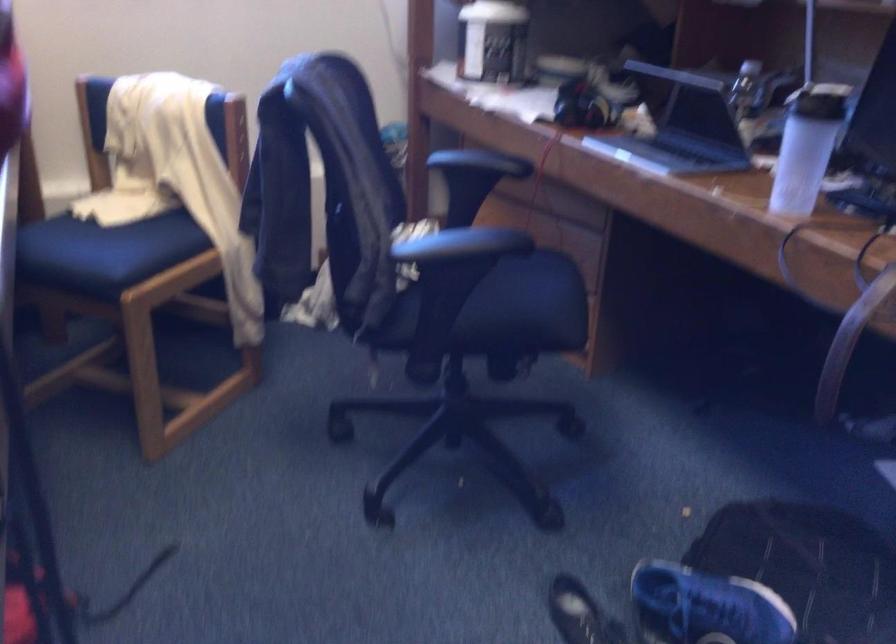
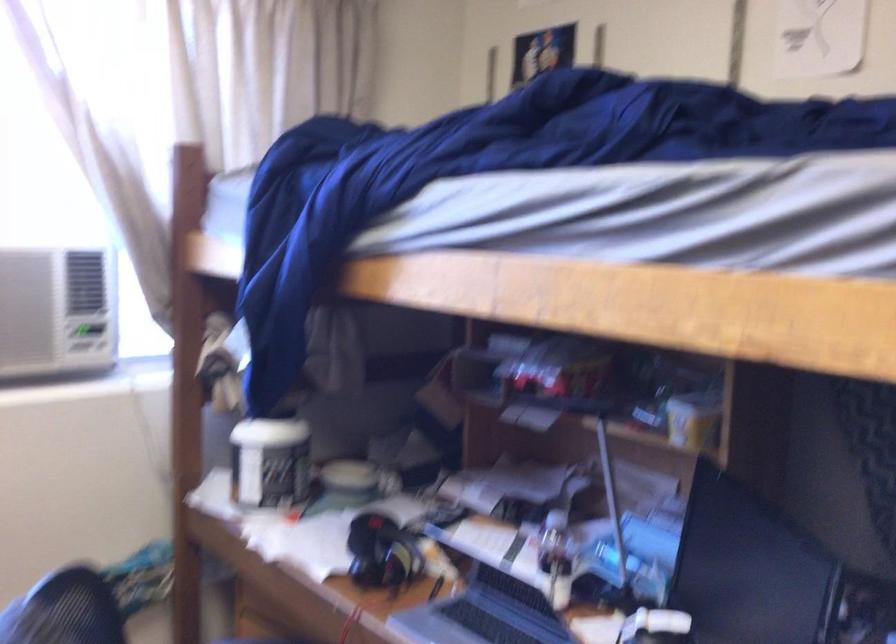
First-person continuous shooting, in which direction is the camera rotating?

The camera's rotation is toward right-up.